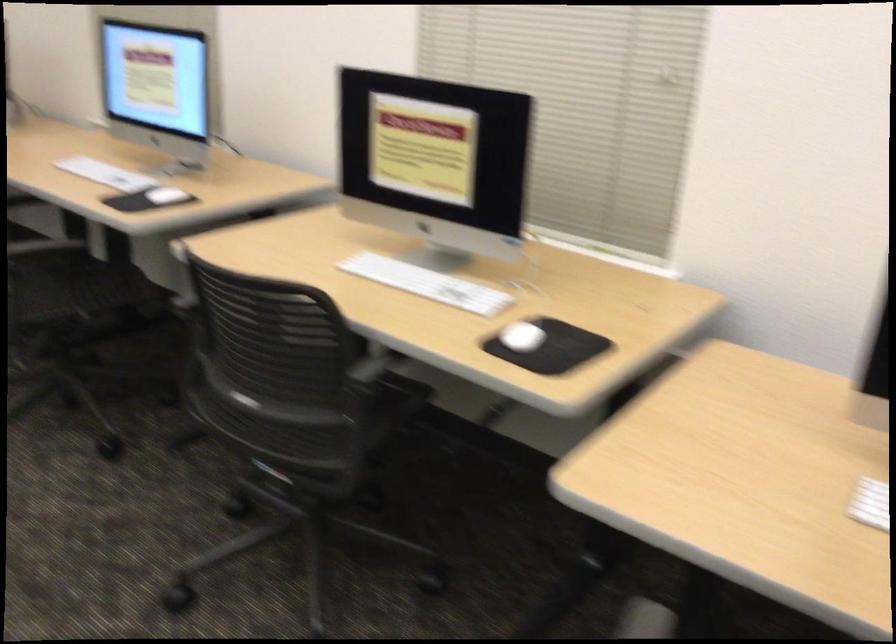
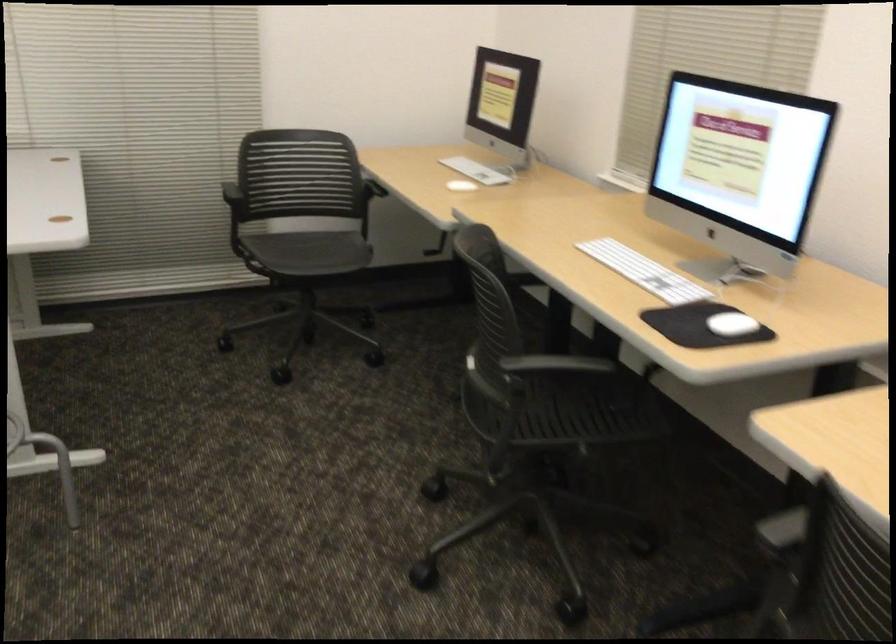
What movement of the cameraman would produce the second image?

The movement direction of the cameraman is left, forward.